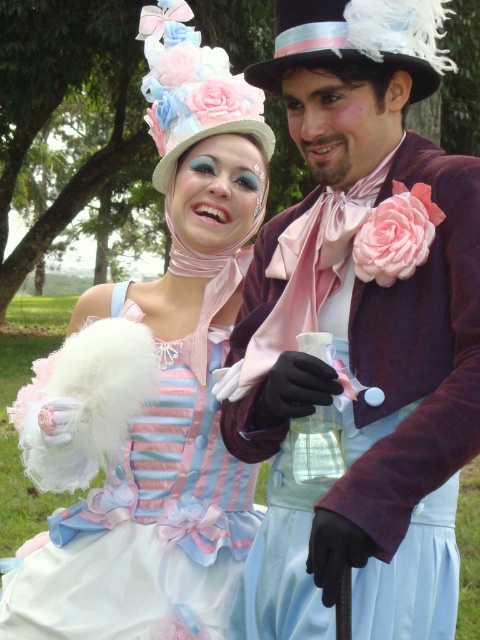
Question: Is matte purple coat at center in front of pastel striped fabric dress at center?

Choices:
 (A) yes
 (B) no

Answer: (A)

Question: Among these points, which one is nearest to the camera?

Choices:
 (A) (117, 308)
 (B) (406, 360)

Answer: (B)

Question: Which point is farther from the camera taking this photo?

Choices:
 (A) (279, 33)
 (B) (216, 445)

Answer: (B)

Question: In this image, where is pastel striped fabric dress at center located relative to black felt dress hat at upper center?

Choices:
 (A) right
 (B) left

Answer: (B)

Question: Is matte purple coat at center further to the viewer compared to pastel striped fabric dress at center?

Choices:
 (A) no
 (B) yes

Answer: (A)

Question: Which point is farther to the camera?

Choices:
 (A) matte purple coat at center
 (B) black felt dress hat at upper center
 (C) pastel striped fabric dress at center

Answer: (C)